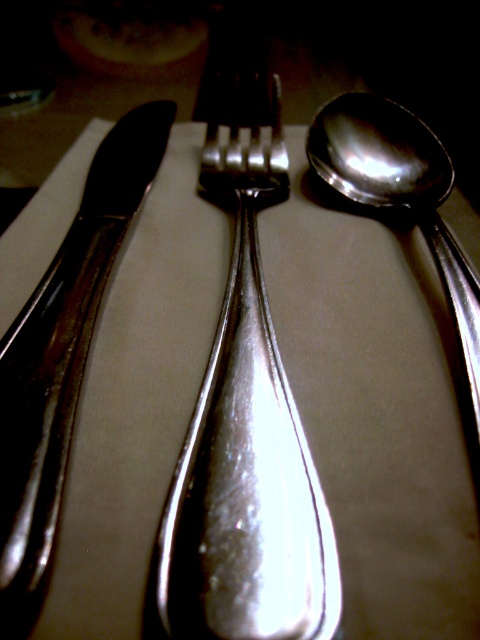
You are looking at the silverware arrangement and need to determine which point is closer to you. The points are labeled as point 1 at coordinates point [239,284] and point 2 at coordinates point [9,529]. Which point is closer to your viewpoint?

Point [239,284] is further to the viewer than point [9,529], so point [9,529] is closer to your viewpoint.

You are setting the table and need to place the polished silver fork at center and the polished silver knife at left. Which one is taller?

The polished silver fork at center is taller than the polished silver knife at left.